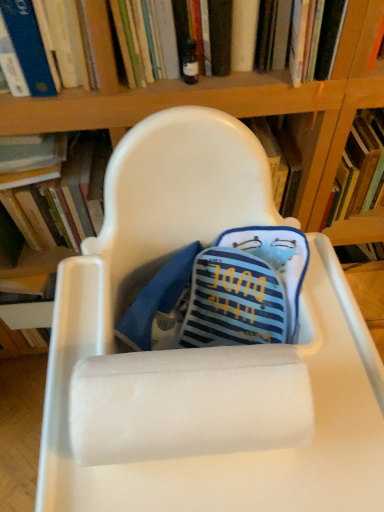
Question: In the image, is hardcover book at upper center, the 3th book in the left-to-right sequence, positioned in front of or behind hardcover book at left, which is the third book from right to left?

Choices:
 (A) behind
 (B) front

Answer: (B)

Question: From a real-world perspective, is hardcover book at upper center, the 1th book viewed from the right, positioned above or below hardcover book at left, the first book from the left?

Choices:
 (A) below
 (B) above

Answer: (B)

Question: Which object is positioned closest to the hardcover book at upper center, the 3th book in the left-to-right sequence?

Choices:
 (A) white fluffy paper towel at center
 (B) hardcover book at left, which is the third book from right to left
 (C) white plastic chair at center
 (D) blue hardcover book at upper left, arranged as the 2th book when viewed from the left

Answer: (D)

Question: Estimate the real-world distances between objects in this image. Which object is closer to the white plastic chair at center?

Choices:
 (A) white fluffy paper towel at center
 (B) hardcover book at upper center, the 3th book in the left-to-right sequence
 (C) blue hardcover book at upper left, arranged as the 2th book when viewed from the left
 (D) hardcover book at left, the first book from the left

Answer: (A)